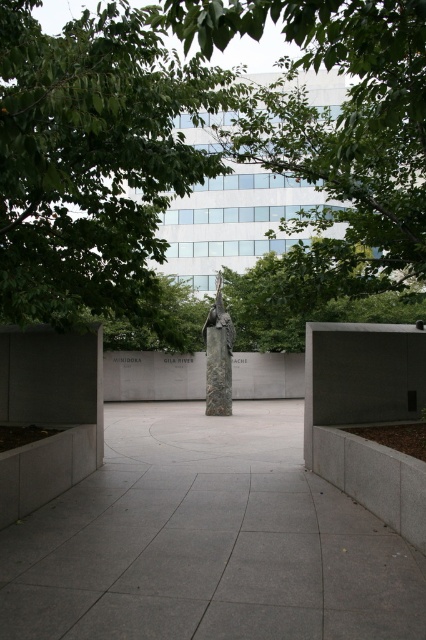
You are an architect designing a new memorial garden. You want to ensure that the green leafy tree at center and the rustic stone sculpture at center are visible from the entrance path. Given their height difference, which one will be more visible from a distance?

The green leafy tree at center is much taller than the rustic stone sculpture at center, so it will be more visible from a distance.

You are standing in the memorial space and want to take a photo of the green leafy tree at center. If your camera has a maximum focus range of 8 feet, will you be able to capture the tree clearly?

The green leafy tree at center is 8.53 feet away from the viewer. Since the camera can only focus up to 8 feet, it won not be able to capture the tree clearly.

You are a landscape architect designing a new memorial garden. You need to ensure that the green leafy tree at center does not overshadow the gray concrete pavement at center. Based on the image, is the tree currently taller than the pavement?

The green leafy tree at center is taller than the gray concrete pavement at center, so yes, the tree is currently taller than the pavement.